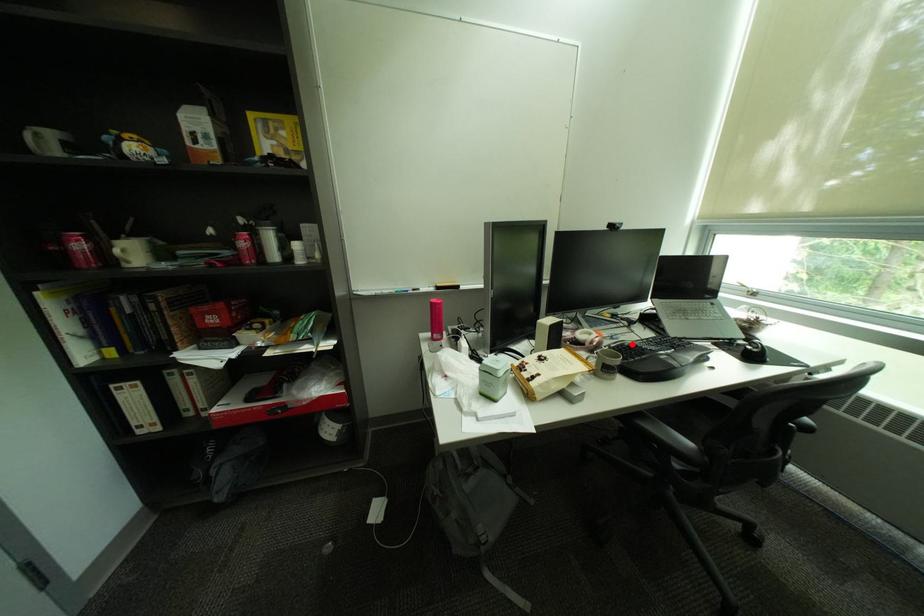
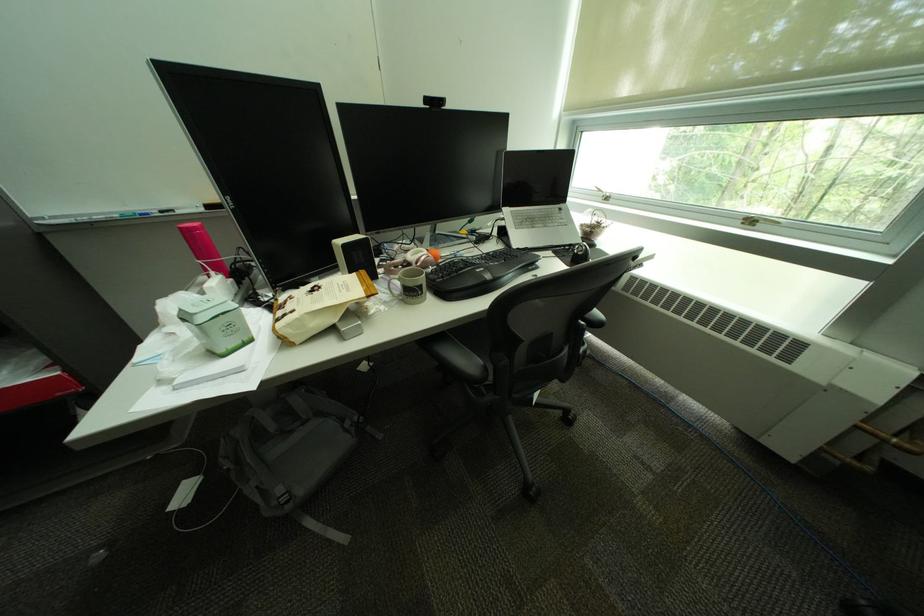
Locate, in the second image, the point that corresponds to the highlighted location in the first image.

(463, 261)